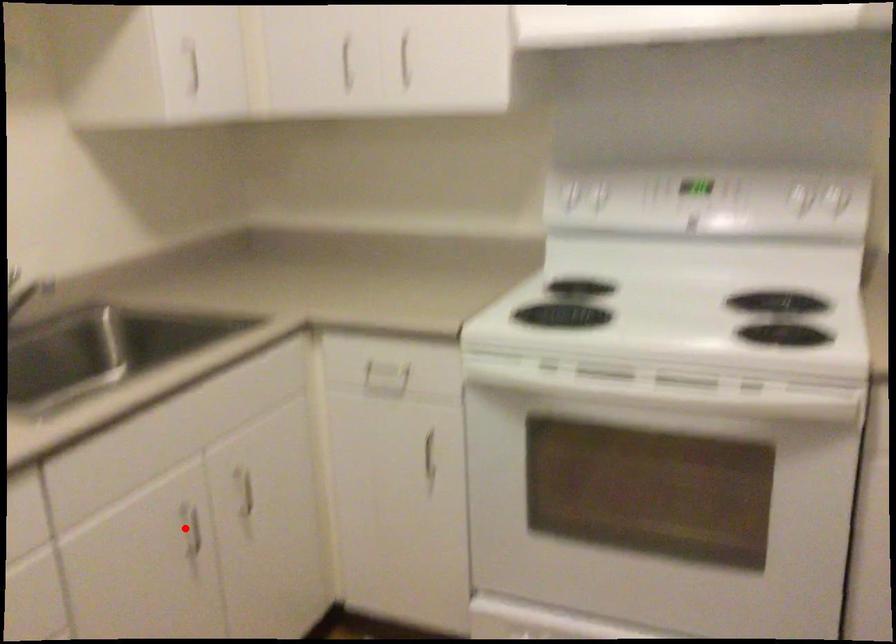
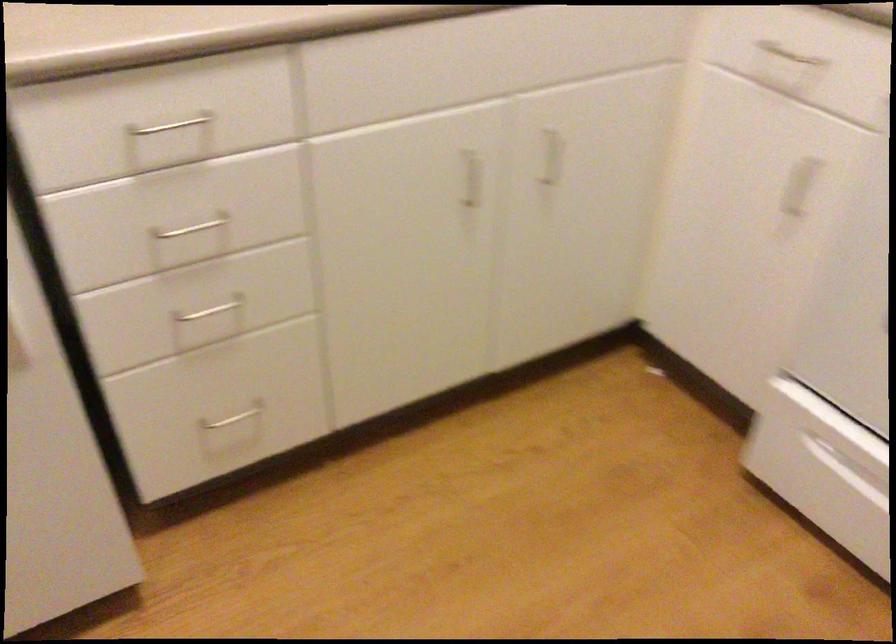
Question: I am providing you with two images of the same scene from different viewpoints. Image1 has a red point marked. In image2, the corresponding 3D location appears at what relative position? Reply with the corresponding letter.

Choices:
 (A) Closer
 (B) Farther

Answer: (A)